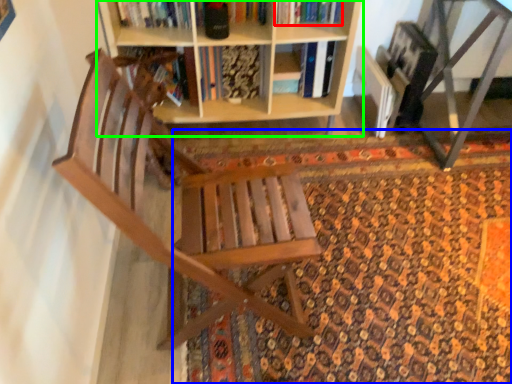
Question: Which object is the farthest from book (highlighted by a red box)? Choose among these: doormat (highlighted by a blue box) or shelf (highlighted by a green box).

Choices:
 (A) doormat
 (B) shelf

Answer: (A)